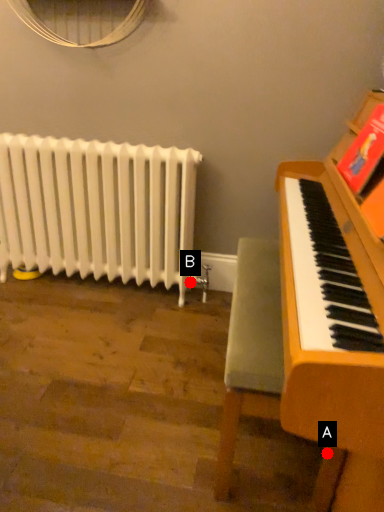
Question: Two points are circled on the image, labeled by A and B beside each circle. Which of the following is the closest to the observer?

Choices:
 (A) A is closer
 (B) B is closer

Answer: (A)